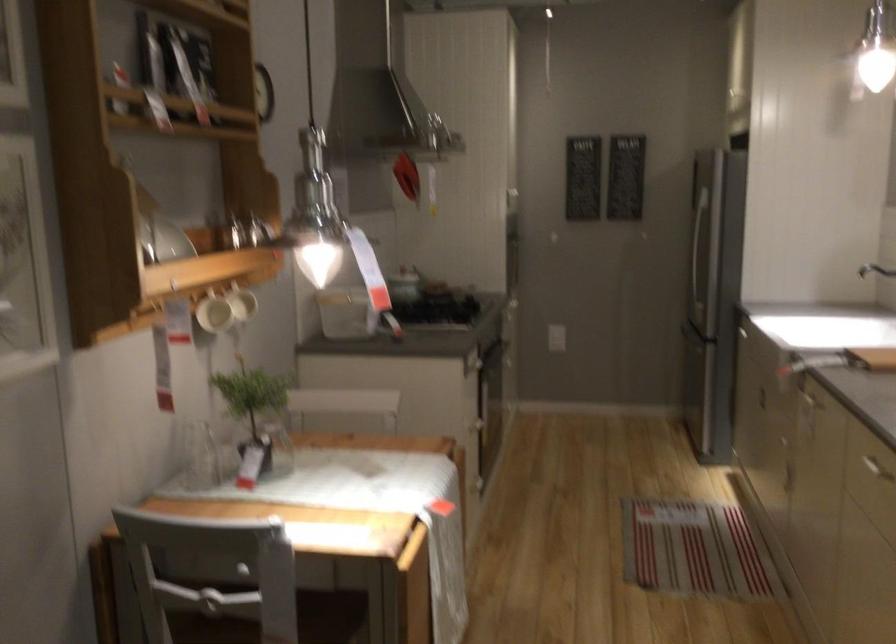
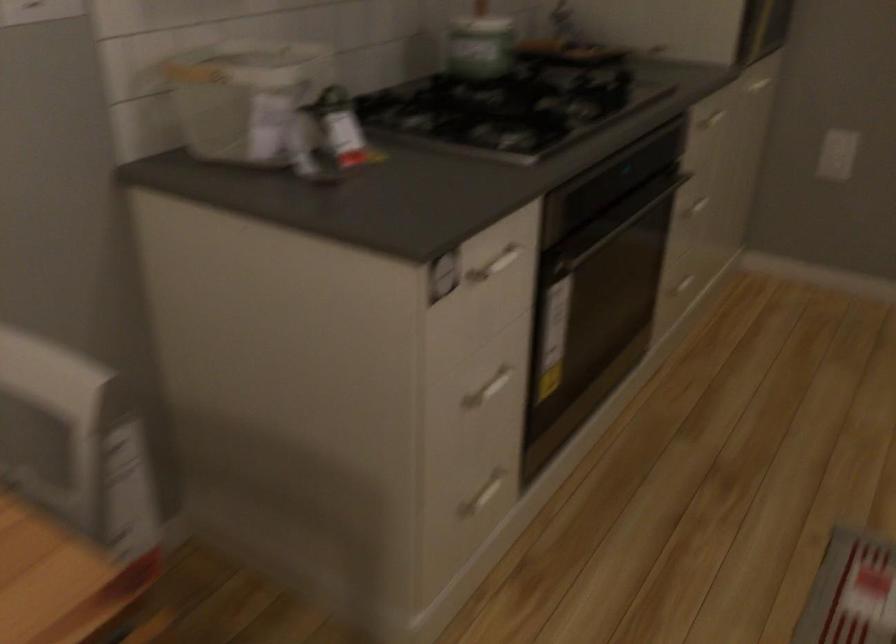
Find the pixel in the second image that matches point 483,424 in the first image.

(487, 389)